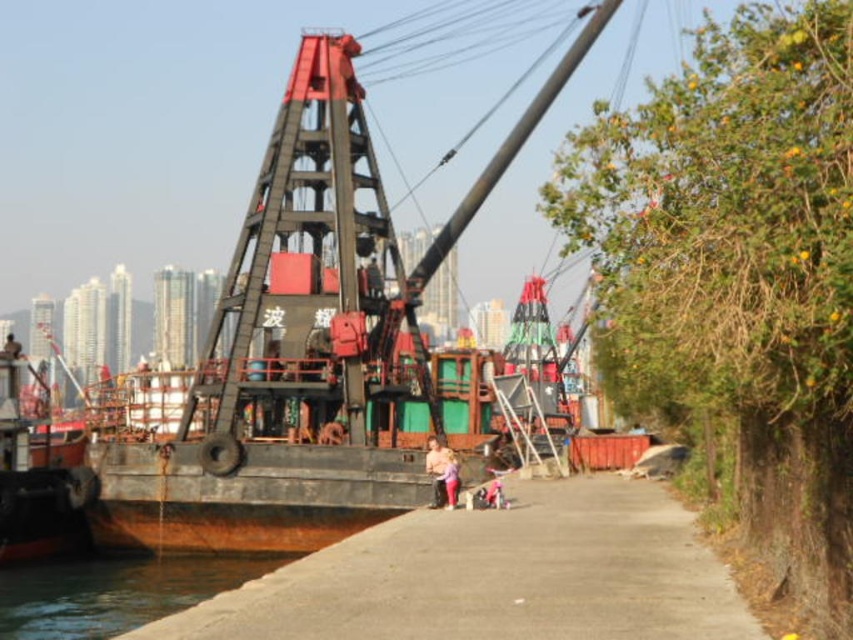
Measure the distance between clear water at lower left and matte pink pants at center.

clear water at lower left and matte pink pants at center are 28.98 meters apart.

Consider the image. Can you confirm if clear water at lower left is thinner than matte pink pants at center?

No.

Locate an element on the screen. clear water at lower left is located at coordinates (111, 593).

Is concrete sidewalk at center bigger than clear water at lower left?

Answer: Yes, concrete sidewalk at center is bigger than clear water at lower left.

Between point (575, 584) and point (4, 572), which one is positioned behind?

The point (4, 572) is behind.

Where is `concrete sidewalk at center`? The height and width of the screenshot is (640, 853). concrete sidewalk at center is located at coordinates (495, 577).

Can you confirm if matte pink pants at center is positioned below pink fabric pants at lower center?

No.

Does matte pink pants at center appear on the right side of pink fabric pants at lower center?

No, matte pink pants at center is not to the right of pink fabric pants at lower center.

Which is in front, point (428, 467) or point (450, 497)?

Point (450, 497) is more forward.

You are a GUI agent. You are given a task and a screenshot of the screen. Output one action in this format:
    pyautogui.click(x=<x>, y=<y>)
    Task: Click on the matte pink pants at center
    
    Given the screenshot: What is the action you would take?
    pyautogui.click(x=440, y=472)